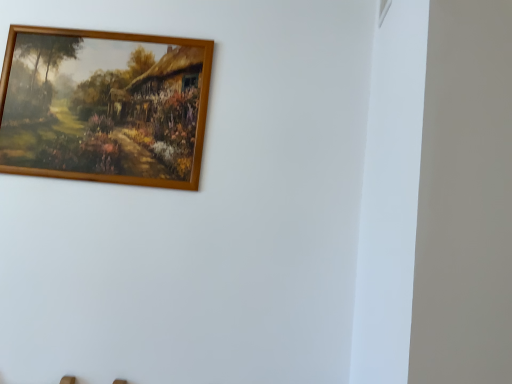
What do you see at coordinates (383, 10) in the screenshot? I see `white plastic window at upper right` at bounding box center [383, 10].

What is the approximate width of white plastic window at upper right?

white plastic window at upper right is 1.44 centimeters in width.

Identify the location of white plastic window at upper right. (383, 10).

Locate an element on the screen. wooden frame at upper left is located at coordinates (104, 106).

What do you see at coordinates (104, 106) in the screenshot? I see `wooden frame at upper left` at bounding box center [104, 106].

Find the location of a particular element. The image size is (512, 384). white plastic window at upper right is located at coordinates (383, 10).

Considering the positions of objects white plastic window at upper right and wooden frame at upper left in the image provided, who is more to the left, white plastic window at upper right or wooden frame at upper left?

Positioned to the left is wooden frame at upper left.

In the image, is white plastic window at upper right positioned in front of or behind wooden frame at upper left?

white plastic window at upper right is in front of wooden frame at upper left.

Is point (382, 8) farther from camera compared to point (186, 64)?

No.

From the image's perspective, which is above, white plastic window at upper right or wooden frame at upper left?

white plastic window at upper right appears higher in the image.

From a real-world perspective, is white plastic window at upper right under wooden frame at upper left?

No, from a real-world perspective, white plastic window at upper right is not beneath wooden frame at upper left.

Can you confirm if white plastic window at upper right is thinner than wooden frame at upper left?

Yes.

Who is shorter, white plastic window at upper right or wooden frame at upper left?

With less height is white plastic window at upper right.

Considering the relative sizes of white plastic window at upper right and wooden frame at upper left in the image provided, is white plastic window at upper right bigger than wooden frame at upper left?

Actually, white plastic window at upper right might be smaller than wooden frame at upper left.

Does white plastic window at upper right contain wooden frame at upper left?

No, wooden frame at upper left is located outside of white plastic window at upper right.

Is white plastic window at upper right with wooden frame at upper left?

No, white plastic window at upper right is not next to wooden frame at upper left.

Is wooden frame at upper left at the back of white plastic window at upper right?

No, white plastic window at upper right is not facing the opposite direction of wooden frame at upper left.

Can you tell me how much white plastic window at upper right and wooden frame at upper left differ in facing direction?

They differ by 91.1 degrees in their facing directions.

How far apart are white plastic window at upper right and wooden frame at upper left?

white plastic window at upper right is 38.34 inches from wooden frame at upper left.

Where is `picture frame below the white plastic window at upper right (from the image's perspective)`? The image size is (512, 384). picture frame below the white plastic window at upper right (from the image's perspective) is located at coordinates [x=104, y=106].

Which object is positioned more to the right, wooden frame at upper left or white plastic window at upper right?

Positioned to the right is white plastic window at upper right.

Which object is closer to the camera taking this photo, wooden frame at upper left or white plastic window at upper right?

white plastic window at upper right is more forward.

Considering the points (86, 96) and (386, 13), which point is behind, point (86, 96) or point (386, 13)?

The point (86, 96) is behind.

Looking at this image, from the image's perspective, between wooden frame at upper left and white plastic window at upper right, who is located below?

wooden frame at upper left.

From a real-world perspective, is wooden frame at upper left positioned above or below white plastic window at upper right?

Clearly, from a real-world perspective, wooden frame at upper left is below white plastic window at upper right.

Considering the sizes of objects wooden frame at upper left and white plastic window at upper right in the image provided, who is thinner, wooden frame at upper left or white plastic window at upper right?

Thinner between the two is white plastic window at upper right.

Does wooden frame at upper left have a lesser height compared to white plastic window at upper right?

No, wooden frame at upper left is not shorter than white plastic window at upper right.

Is wooden frame at upper left bigger than white plastic window at upper right?

Correct, wooden frame at upper left is larger in size than white plastic window at upper right.

Would you say wooden frame at upper left is outside white plastic window at upper right?

Absolutely, wooden frame at upper left is external to white plastic window at upper right.

Does wooden frame at upper left touch white plastic window at upper right?

They are not placed beside each other.

Is wooden frame at upper left aimed at white plastic window at upper right?

No, wooden frame at upper left is not aimed at white plastic window at upper right.

How far apart are wooden frame at upper left and white plastic window at upper right?

wooden frame at upper left is 38.34 inches from white plastic window at upper right.

Find the location of `picture frame on the left of white plastic window at upper right`. picture frame on the left of white plastic window at upper right is located at coordinates (104, 106).

Identify the location of picture frame that is behind the white plastic window at upper right. (104, 106).

Where is `window above the wooden frame at upper left (from the image's perspective)`? The height and width of the screenshot is (384, 512). window above the wooden frame at upper left (from the image's perspective) is located at coordinates (383, 10).